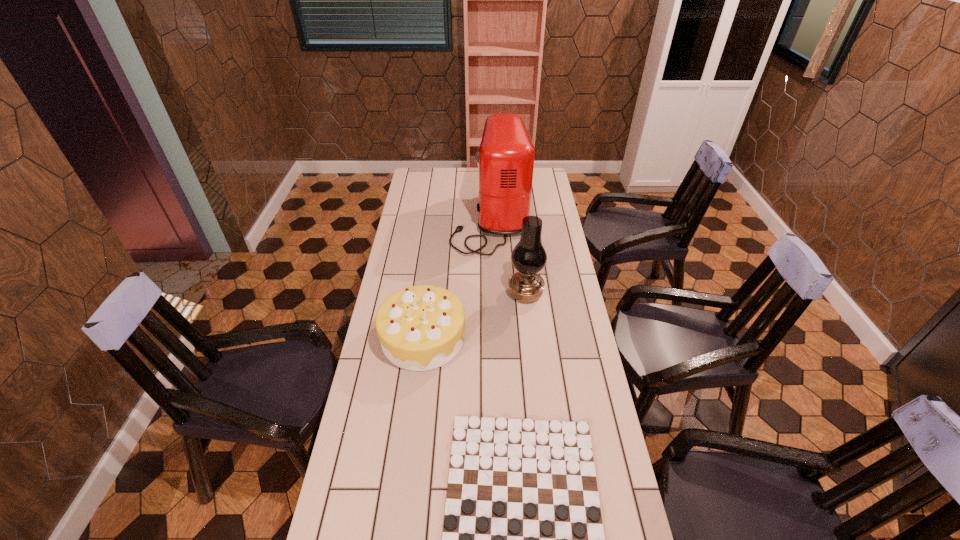
The image size is (960, 540). In order to click on free spot located 0.270m on the back of the second shortest object in this screenshot , I will do click(433, 262).

Locate an element on the screen. object present at the far edge is located at coordinates (505, 159).

Identify the location of object located at the left edge. (422, 327).

You are a GUI agent. You are given a task and a screenshot of the screen. Output one action in this format:
    pyautogui.click(x=<x>, y=<y>)
    Task: Click on the kitchen mixer that is at the right edge
    
    Given the screenshot: What is the action you would take?
    pyautogui.click(x=505, y=159)

This screenshot has width=960, height=540. In order to click on oil lamp that is at the right edge in this screenshot , I will do `click(529, 257)`.

Identify the location of object located in the far right corner section of the desktop. The height and width of the screenshot is (540, 960). (505, 159).

Find the location of `vacant space at the left edge of the desktop`. vacant space at the left edge of the desktop is located at coordinates (361, 389).

You are a GUI agent. You are given a task and a screenshot of the screen. Output one action in this format:
    pyautogui.click(x=<x>, y=<y>)
    Task: Click on the vacant space at the right edge
    This screenshot has width=960, height=540.
    Given the screenshot: What is the action you would take?
    pyautogui.click(x=578, y=370)

Where is `vacant point located between the second farthest object and the kitchen mixer`? The image size is (960, 540). vacant point located between the second farthest object and the kitchen mixer is located at coordinates (508, 256).

Where is `vacant region between the farthest object and the third tallest object`? The image size is (960, 540). vacant region between the farthest object and the third tallest object is located at coordinates (457, 279).